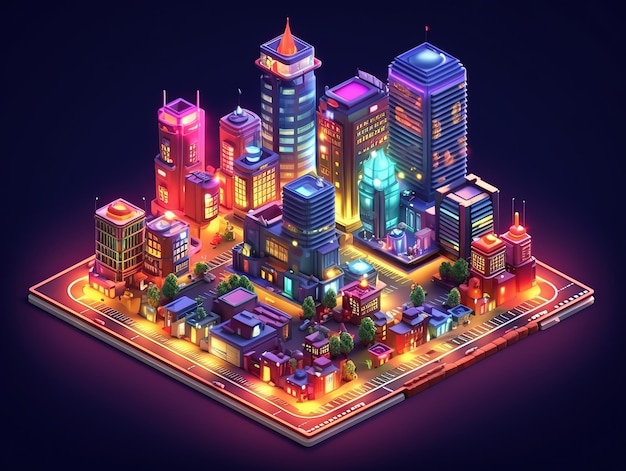
I want to click on door, so click(x=195, y=334).